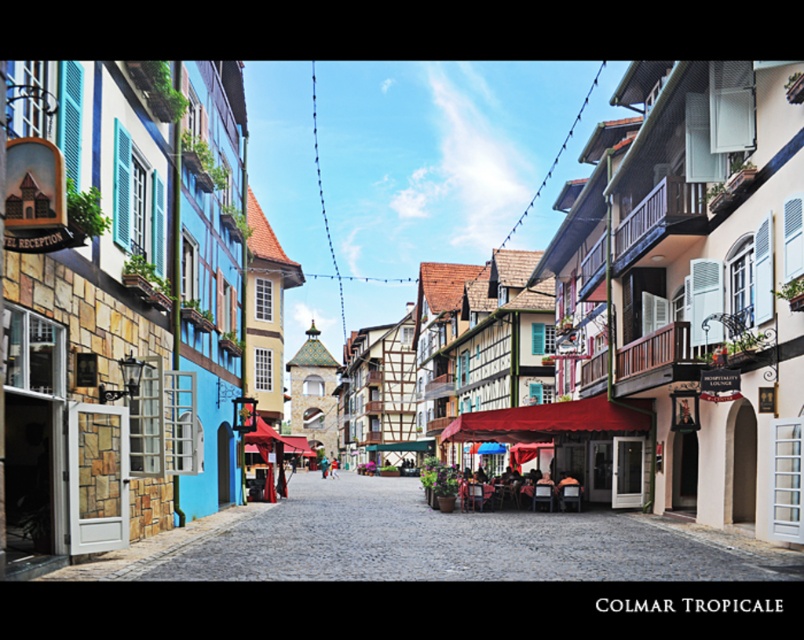
Who is more forward, [489,579] or [564,412]?

Point [489,579] is in front.

Is smooth stone street at center closer to the viewer compared to red fabric canopy at center?

Yes, smooth stone street at center is closer to the viewer.

Which is behind, point (647, 528) or point (603, 396)?

Positioned behind is point (603, 396).

This screenshot has height=640, width=804. Identify the location of smooth stone street at center. (457, 541).